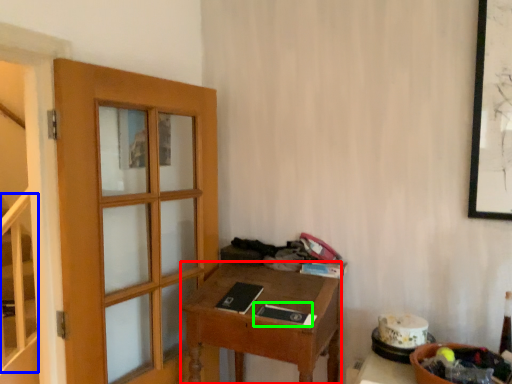
Question: Which object is positioned closest to desk (highlighted by a red box)? Select from stairwell (highlighted by a blue box) and book (highlighted by a green box).

Choices:
 (A) stairwell
 (B) book

Answer: (B)